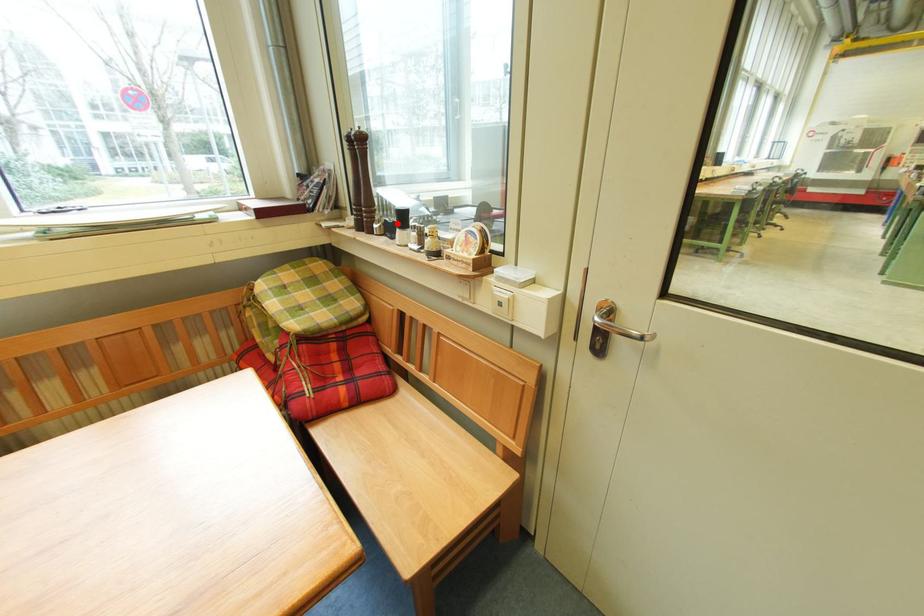
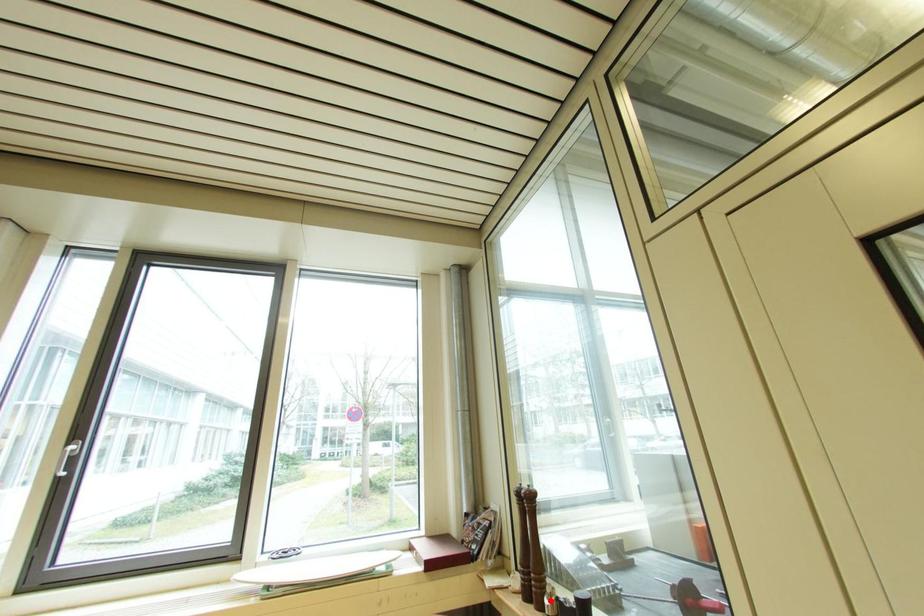
I am providing you with two images of the same scene from different viewpoints. A red point is marked on the first image and another point is marked on the second image. Are the points marked in image1 and image2 representing the same 3D position?

No